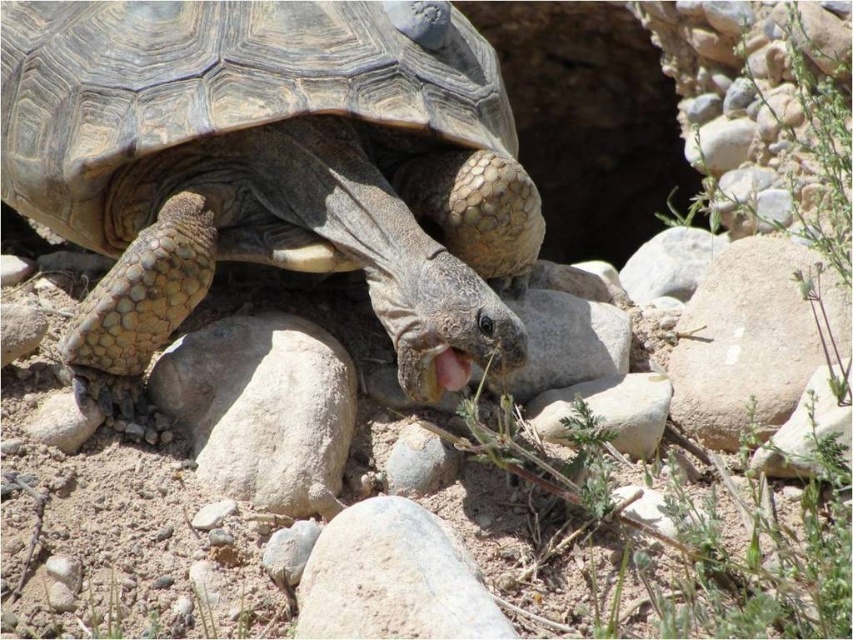
You are a wildlife photographer aiming to capture a closeup of the leathery brown tortoise at center and the gray rough rock at lower center. Which object should you zoom in on to ensure both are in focus without adjusting your camera settings?

The leathery brown tortoise at center is larger in size than the gray rough rock at lower center, so you should zoom in on the leathery brown tortoise at center to ensure both are in focus without needing to adjust your camera settings.

You are observing the desert tortoise in its habitat. Based on its position, can you determine if the leathery brown tortoise at center is closer to the left or right side of the image?

The leathery brown tortoise at center is located at point 0.261 on the x and 0.318 on the y, which places it closer to the left side of the image.

Based on the photo, you are a photographer aiming to capture the desert tortoise. You notice two points on the tortoise, one at point (242, 499) and another at point (444, 388). Which point should you focus on to ensure it appears larger in your photo?

Point (242, 499) is closer to the camera than point (444, 388), so focusing on point (242, 499) will make it appear larger in the photo.